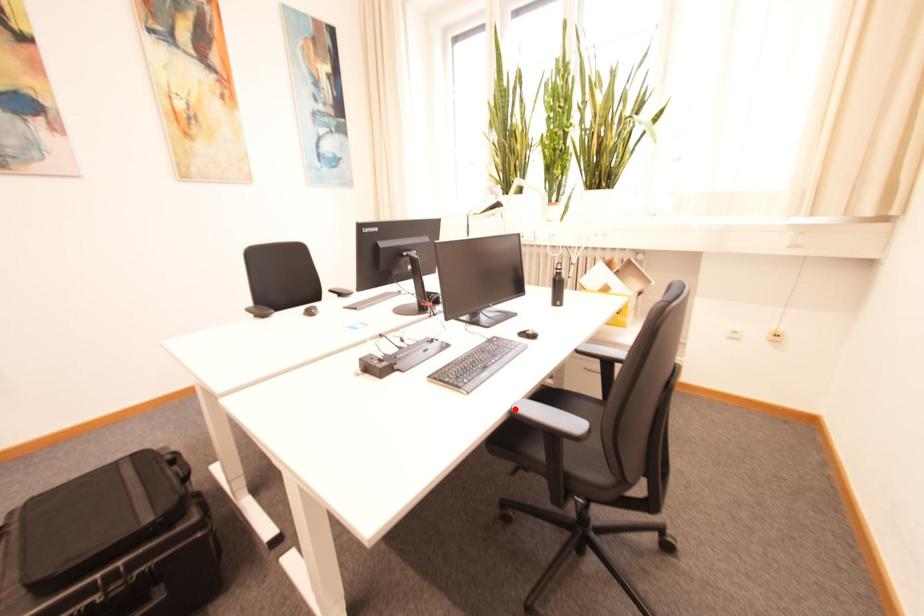
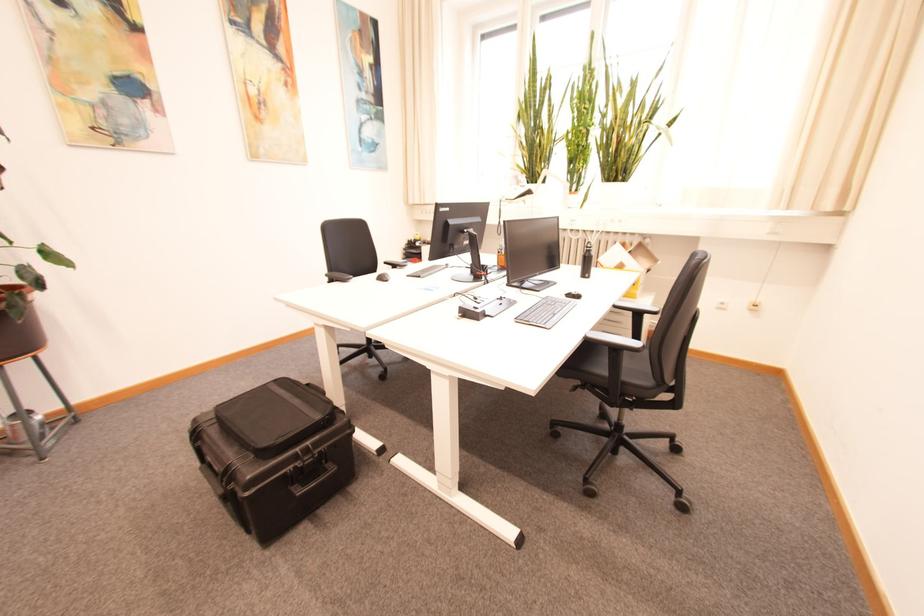
Locate, in the second image, the point that corresponds to the highlighted location in the first image.

(590, 337)